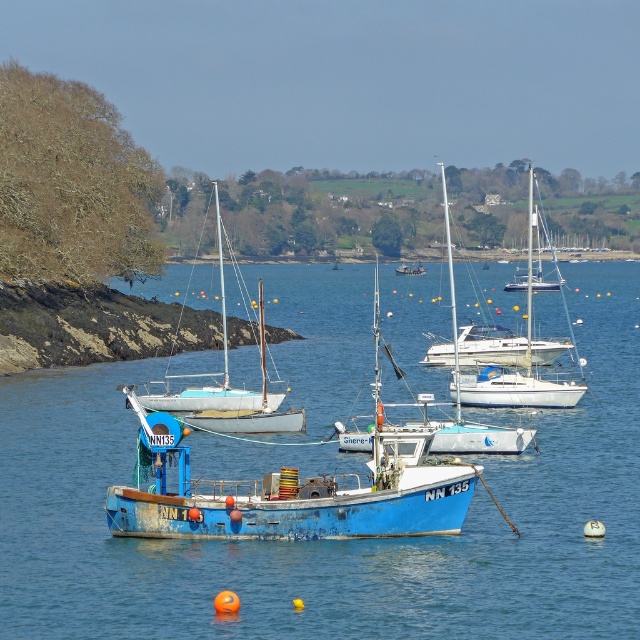
Question: Which of the following is the closest to the observer?

Choices:
 (A) (150, 404)
 (B) (160, 420)

Answer: (B)

Question: Can you confirm if blue painted water at center is positioned to the right of blue painted wooden fishing boat at center?

Choices:
 (A) yes
 (B) no

Answer: (A)

Question: Does blue painted wooden fishing boat at center appear over white matte sailboat at center?

Choices:
 (A) no
 (B) yes

Answer: (A)

Question: Which point is farther to the camera?

Choices:
 (A) (262, 321)
 (B) (252, 518)

Answer: (A)

Question: Among these objects, which one is farthest from the camera?

Choices:
 (A) blue painted wooden fishing boat at center
 (B) blue painted water at center
 (C) white matte sailboat at center
 (D) blue painted wooden sailboat at center

Answer: (D)

Question: Is blue painted water at center wider than blue painted wooden sailboat at center?

Choices:
 (A) yes
 (B) no

Answer: (A)